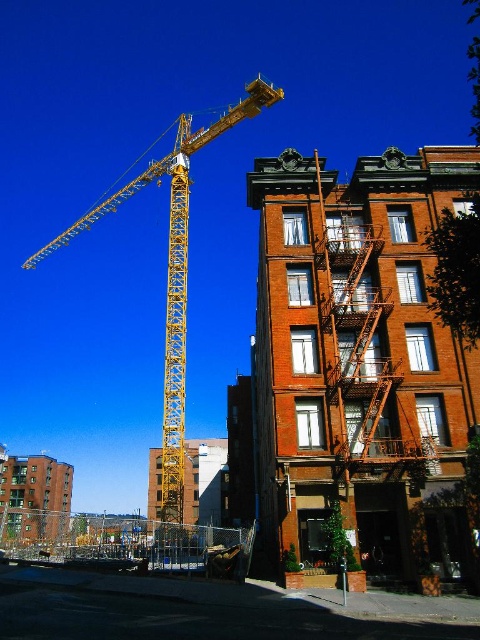
You are standing at the coordinates point 0.5, 0.7 in the urban scene. You want to walk towards the brick building at center. In which direction should you move?

The brick building at center is located at point (360, 362). Since you are at point (336, 320), you should move northeast to reach it.